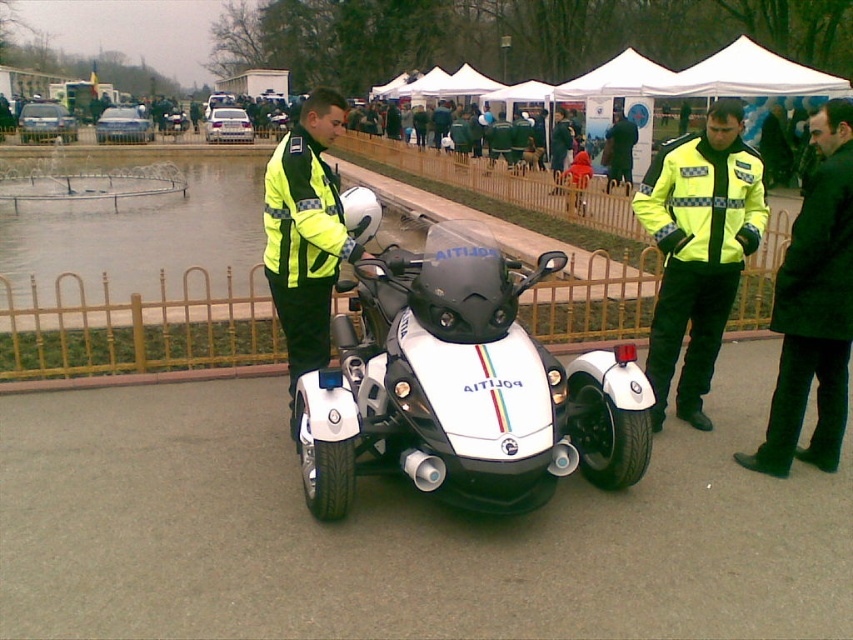
Question: Considering the real-world distances, which object is closest to the white glossy trike at center?

Choices:
 (A) brushed metal water at left
 (B) yellow reflective jacket at center

Answer: (B)

Question: Which is nearer to the yellow reflective jacket at center?

Choices:
 (A) white glossy trike at center
 (B) brushed metal water at left

Answer: (A)

Question: Which object is closer to the camera taking this photo?

Choices:
 (A) yellow reflective jacket at center
 (B) black leather jacket at right
 (C) neon yellow reflective jacket at center

Answer: (B)

Question: Can you confirm if yellow reflective jacket at center is positioned above black leather jacket at right?

Choices:
 (A) yes
 (B) no

Answer: (A)

Question: Does white glossy trike at center have a larger size compared to brushed metal water at left?

Choices:
 (A) yes
 (B) no

Answer: (B)

Question: Is yellow reflective jacket at center positioned behind neon yellow reflective jacket at center?

Choices:
 (A) no
 (B) yes

Answer: (B)